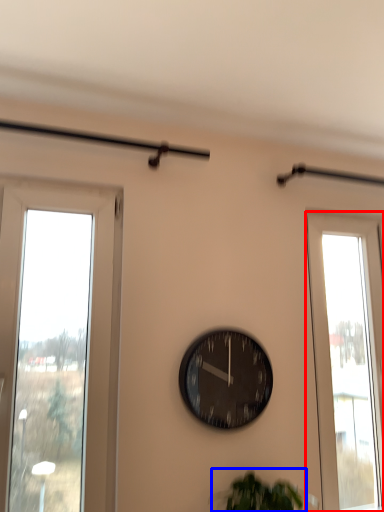
Question: Among these objects, which one is farthest to the camera, window (highlighted by a red box) or plant (highlighted by a blue box)?

Choices:
 (A) window
 (B) plant

Answer: (A)